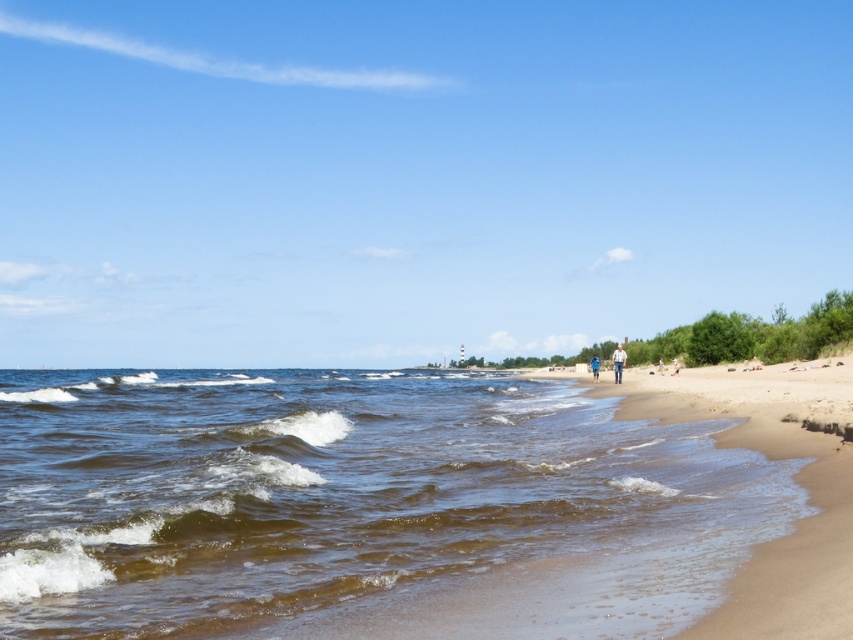
You are a photographer trying to capture the entire scene of the brown sandy water at lower left and the blue denim shorts at center in one shot. Based on their sizes in the image, which object would require you to zoom out more to include both in the frame?

The brown sandy water at lower left has a larger width than the blue denim shorts at center, so you would need to zoom out more to include both the brown sandy water at lower left and the blue denim shorts at center in the frame.

You are a photographer trying to capture a candid shot of the beach scene. You notice the light brown leather jacket at center and the blue denim shorts at center. Which object should you focus on if you want to photograph the taller item?

The blue denim shorts at center are taller than the light brown leather jacket at center, so you should focus on the blue denim shorts at center to capture the taller item.